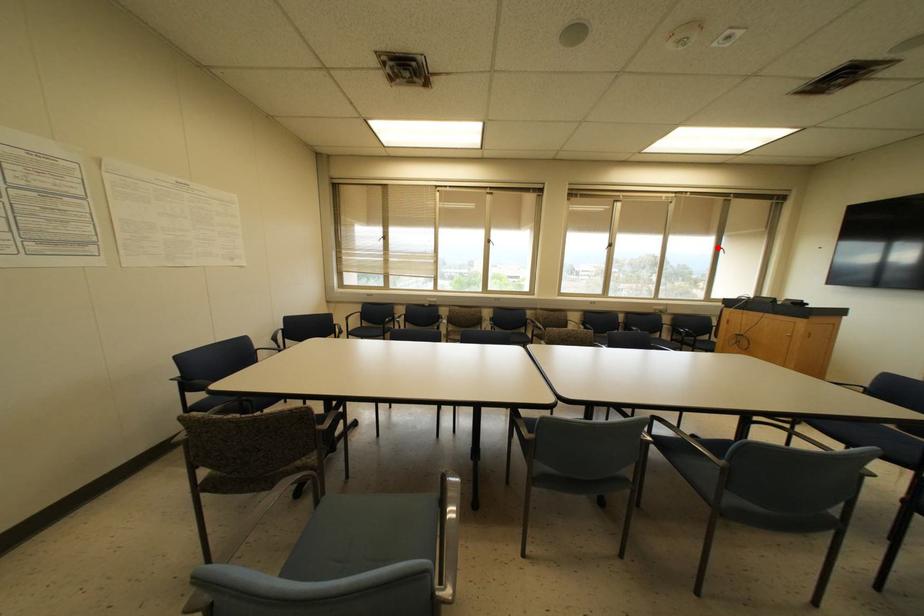
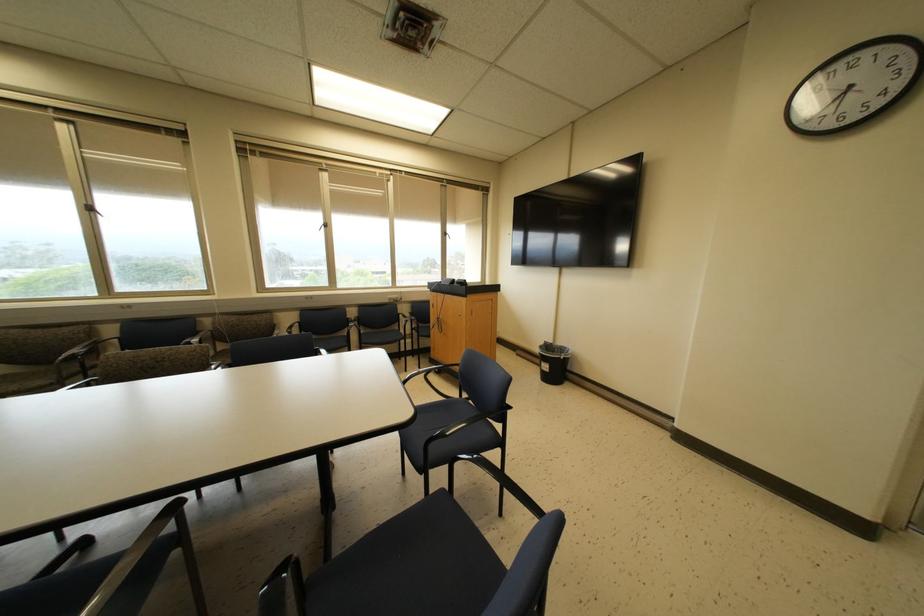
Question: I am providing you with two images of the same scene from different viewpoints. A red point is marked on the first image. Is the red point's position out of view in image 2?

Choices:
 (A) Yes
 (B) No

Answer: (B)